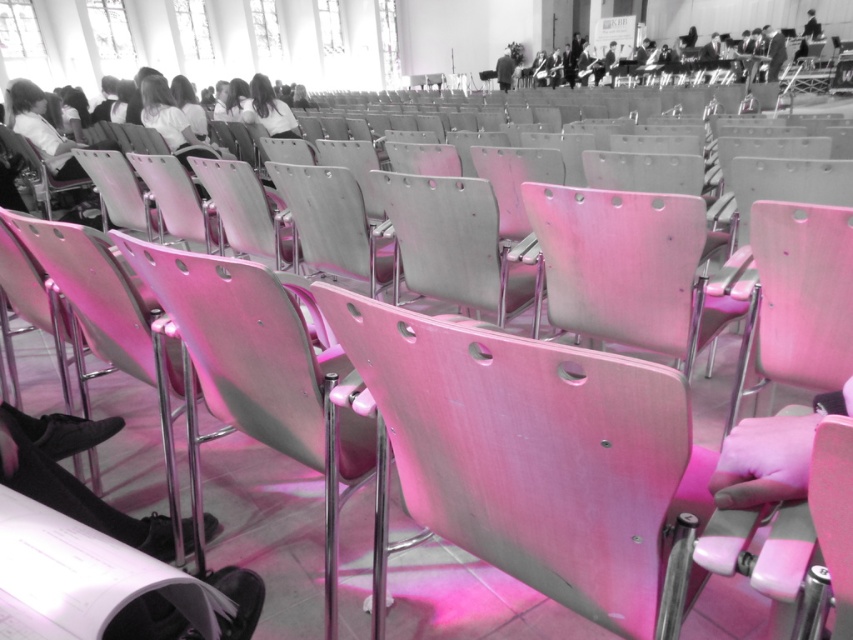
Does black leather shoes at lower left appear over dark gray suit at upper right?

Incorrect, black leather shoes at lower left is not positioned above dark gray suit at upper right.

Looking at this image, which of these two, black leather shoes at lower left or dark gray suit at upper right, stands taller?

Standing taller between the two is dark gray suit at upper right.

The height and width of the screenshot is (640, 853). Find the location of `black leather shoes at lower left`. black leather shoes at lower left is located at coordinates (70, 477).

Which is more to the right, dark gray suit at upper right or metallic silver person at center?

From the viewer's perspective, dark gray suit at upper right appears more on the right side.

Is dark gray suit at upper right taller than metallic silver person at center?

Correct, dark gray suit at upper right is much taller as metallic silver person at center.

Is point (785, 52) positioned before point (505, 81)?

Yes, point (785, 52) is closer to viewer.

You are a GUI agent. You are given a task and a screenshot of the screen. Output one action in this format:
    pyautogui.click(x=<x>, y=<y>)
    Task: Click on the dark gray suit at upper right
    The image size is (853, 640).
    Given the screenshot: What is the action you would take?
    pyautogui.click(x=775, y=51)

Does dark gray suit at upper right appear over black fabric jacket at upper center?

No.

Is point (769, 52) farther from camera compared to point (815, 33)?

No, (769, 52) is closer to viewer.

Locate an element on the screen. The width and height of the screenshot is (853, 640). dark gray suit at upper right is located at coordinates (775, 51).

Where is `dark gray suit at upper right`? The height and width of the screenshot is (640, 853). dark gray suit at upper right is located at coordinates (775, 51).